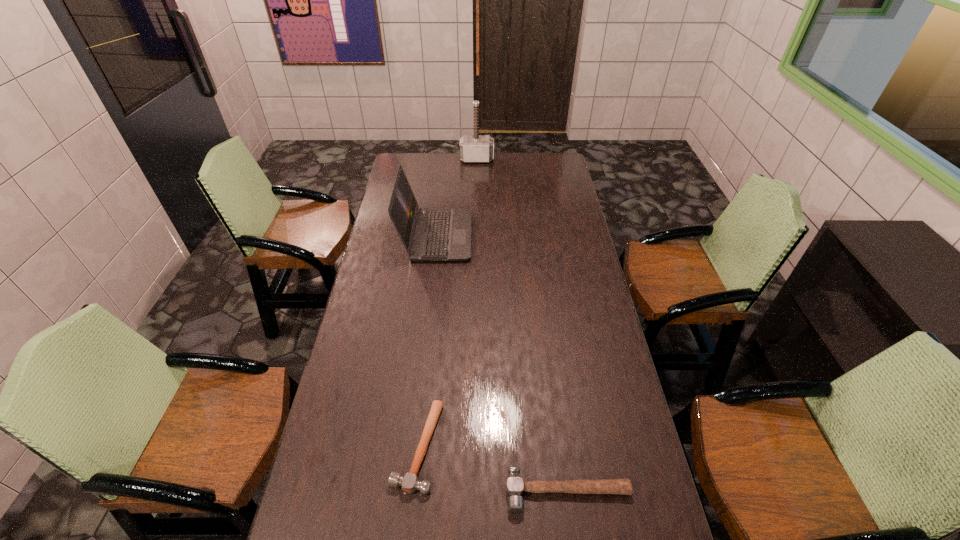
Where is `object that is at the right edge`? The height and width of the screenshot is (540, 960). object that is at the right edge is located at coordinates (515, 486).

This screenshot has width=960, height=540. In the image, there is a desktop. Find the location of `blank space at the far edge`. blank space at the far edge is located at coordinates (474, 168).

At what (x,y) coordinates should I click in order to perform the action: click on free space at the left edge of the desktop. Please return your answer as a coordinate pair (x, y). Image resolution: width=960 pixels, height=540 pixels. Looking at the image, I should click on (361, 468).

The width and height of the screenshot is (960, 540). Identify the location of vacant space at the right edge of the desktop. (548, 194).

Find the location of a particular element. This screenshot has width=960, height=540. vacant region at the far left corner of the desktop is located at coordinates (409, 154).

Identify the location of free space at the far right corner. (543, 159).

The height and width of the screenshot is (540, 960). Find the location of `unoccupied position between the third nearest object and the farthest object`. unoccupied position between the third nearest object and the farthest object is located at coordinates (457, 198).

At what (x,y) coordinates should I click in order to perform the action: click on vacant area that lies between the leftmost hammer and the third nearest object. Please return your answer as a coordinate pair (x, y). Looking at the image, I should click on point(427,341).

This screenshot has height=540, width=960. Identify the location of vacant space that's between the leftmost hammer and the laptop_computer. (427, 341).

In order to click on free space between the second tallest object and the tallest hammer in this screenshot , I will do `click(457, 198)`.